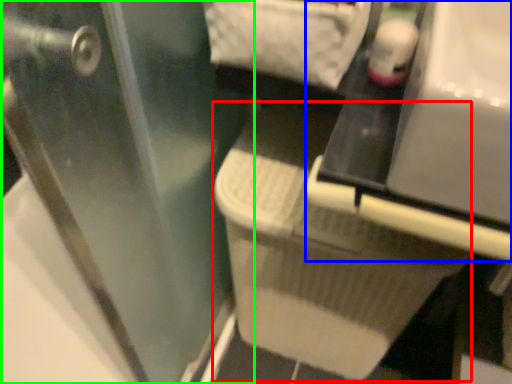
Question: Which is farther away from laundry basket (highlighted by a red box)? vanity (highlighted by a blue box) or screen door (highlighted by a green box)?

Choices:
 (A) vanity
 (B) screen door

Answer: (A)